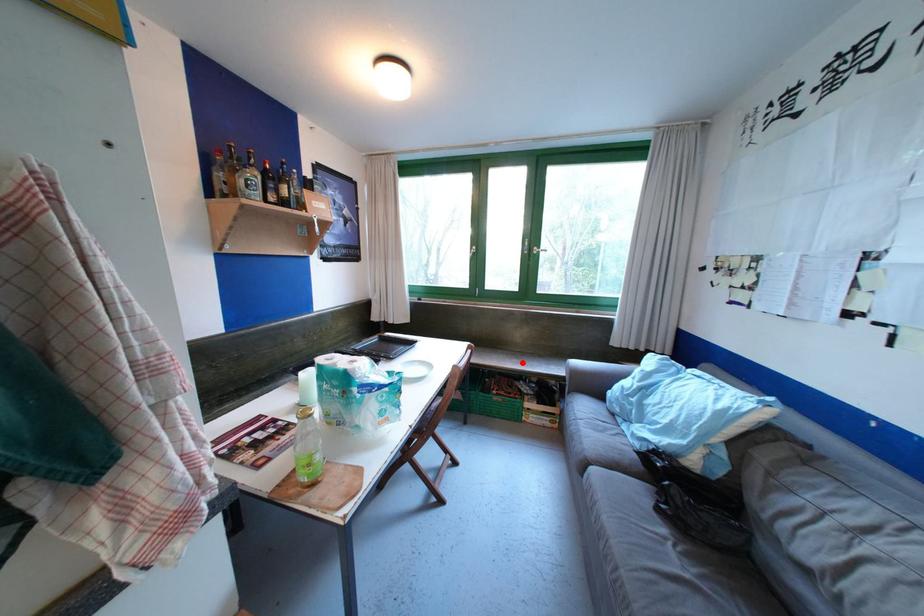
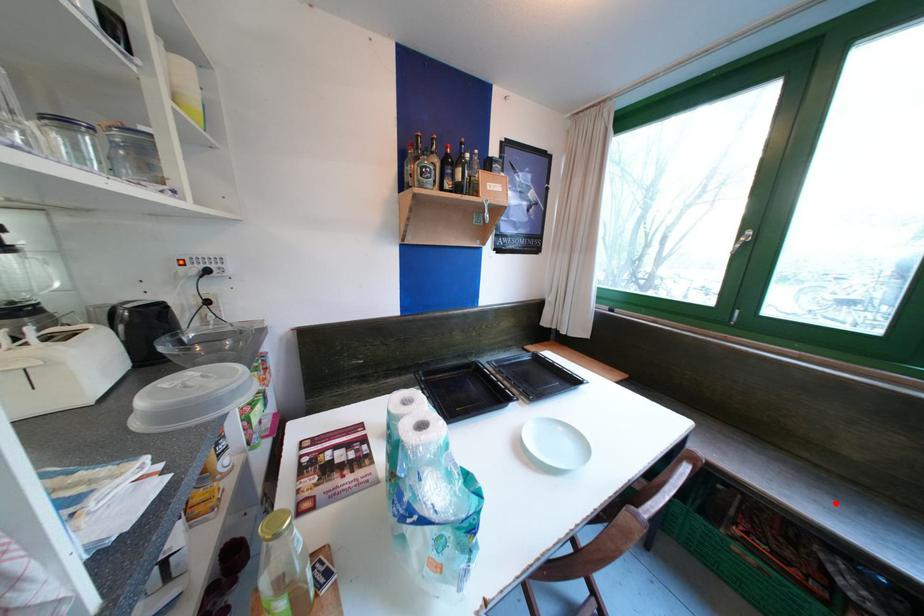
Based on the photo, I am providing you with two images of the same scene from different viewpoints. A red point is marked on the first image and another point is marked on the second image. Are the points marked in image1 and image2 representing the same 3D position?

Yes